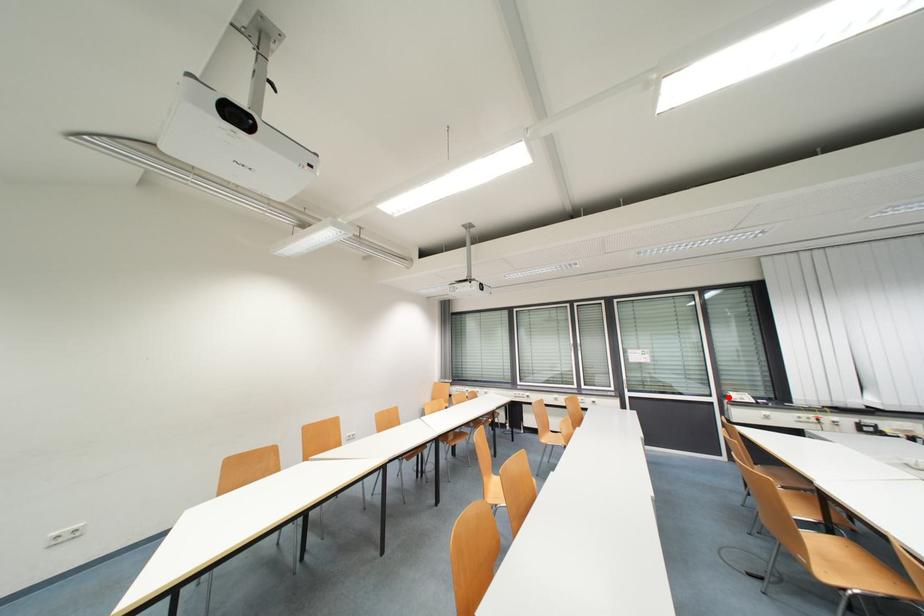
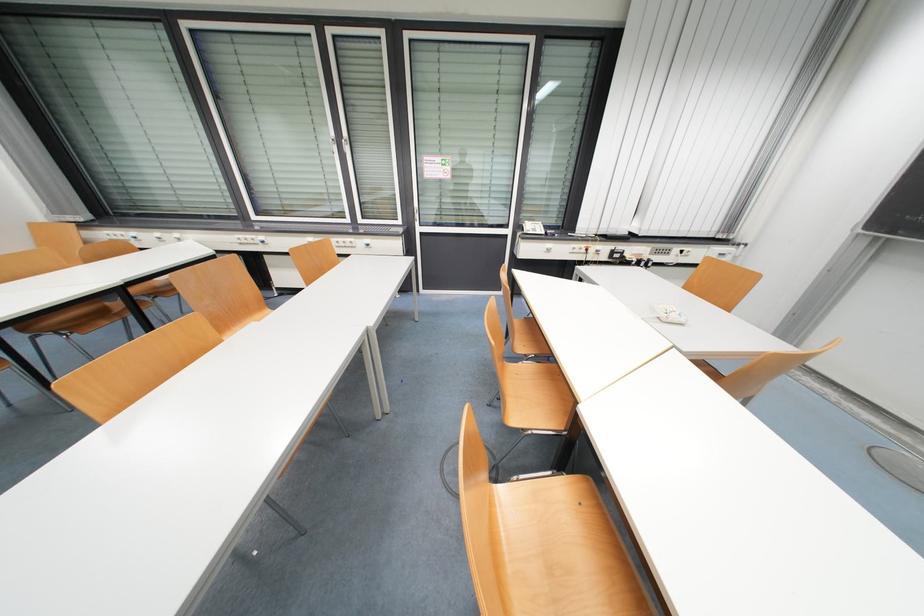
Where in the second image is the point corresponding to the highlighted location from the first image?

(524, 229)